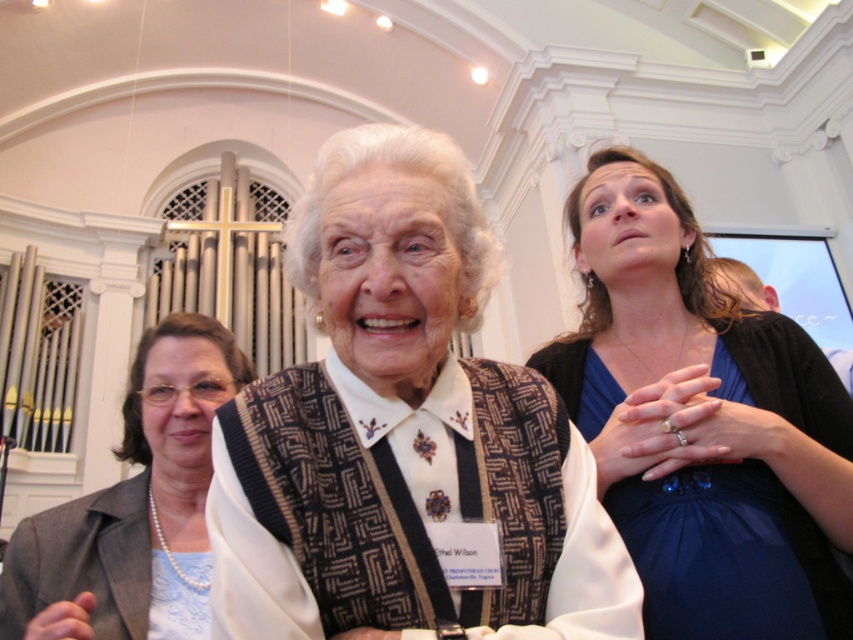
Question: Does patterned fabric sweater at center have a smaller size compared to pearl necklace at left?

Choices:
 (A) no
 (B) yes

Answer: (A)

Question: Which point is closer to the camera?

Choices:
 (A) (126, 504)
 (B) (444, 202)
 (C) (828, 609)

Answer: (B)

Question: Which point is farther to the camera?

Choices:
 (A) patterned fabric sweater at center
 (B) pearl necklace at left
 (C) blue satin dress at upper right

Answer: (B)

Question: Does patterned fabric sweater at center have a smaller size compared to pearl necklace at left?

Choices:
 (A) no
 (B) yes

Answer: (A)

Question: Which of the following is the farthest from the observer?

Choices:
 (A) patterned fabric sweater at center
 (B) blue satin dress at upper right
 (C) pearl necklace at left

Answer: (C)

Question: Can you confirm if blue satin dress at upper right is smaller than pearl necklace at left?

Choices:
 (A) yes
 (B) no

Answer: (B)